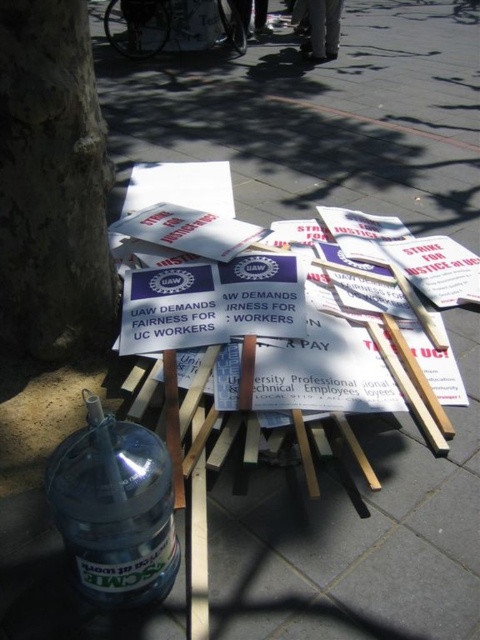
You are organizing a protest and need to set up a hydration station. You have a clear plastic bottle at lower left and a smooth bark tree at lower left. Which object is closer to you if you are standing at the front of the protest area?

The smooth bark tree at lower left is closer because the clear plastic bottle at lower left is behind it.

You are organizing a protest event and need to place a water station. The smooth bark tree at lower left and the clear plastic bottle at lower left are already placed. Can you fit a 20 inch wide table between them for the water station?

The distance between the smooth bark tree at lower left and the clear plastic bottle at lower left is 18.92 inches. Since the table is 20 inches wide, it cannot fit between them as the space is narrower than the table.

You are organizing a protest and need to set up a hydration station. You have a clear plastic bottle at lower left and a smooth bark tree at lower left. Which object can you use to hang a banner for the station?

The smooth bark tree at lower left is taller than the clear plastic bottle at lower left, so you can use the smooth bark tree at lower left to hang the banner as it is taller and more stable.